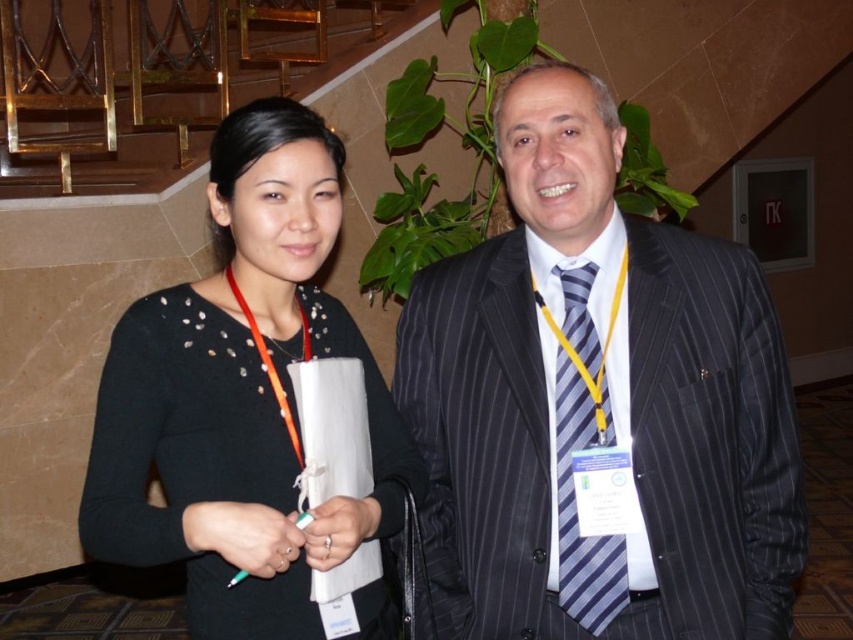
In the image, you see a striped fabric suit at center and a blue striped tie at center. Which one is located more to the left?

The striped fabric suit at center is positioned on the left side of blue striped tie at center, so the striped fabric suit at center is more to the left.

You are standing in the middle of the room and see the point marked at coordinates (598, 404). What object is located at that point?

The point at coordinates (598, 404) corresponds to the striped fabric suit at center.